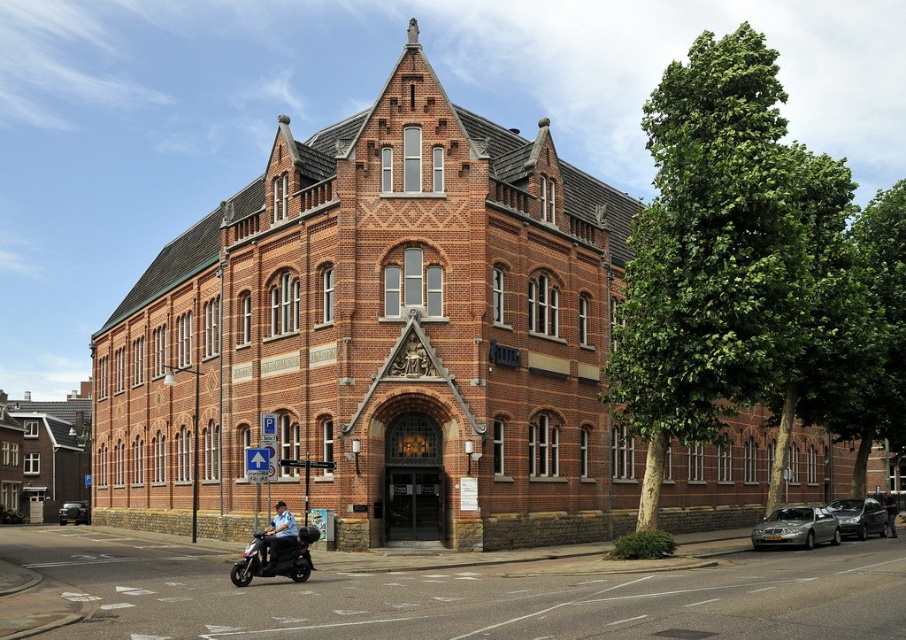
You are a delivery person who needs to park your metallic silver scooter at lower left and your satin silver metallic sedan at lower right in the parking area near the ornate red brick building. Given the size difference between the two vehicles, which one requires more space to park?

The satin silver metallic sedan at lower right requires more space to park because it is larger than the metallic silver scooter at lower left.

You are a delivery person who needs to park your metallic silver scooter at lower left and your satin silver metallic sedan at lower right in the parking lot in front of the ornate red brick building. According to the parking rules, vehicles must be parked in order from left to right based on their size. Which vehicle should be parked first on the left side?

The metallic silver scooter at lower left should be parked first on the left side since it is smaller than the satin silver metallic sedan at lower right, and parking rules require vehicles to be arranged from left to right based on size.